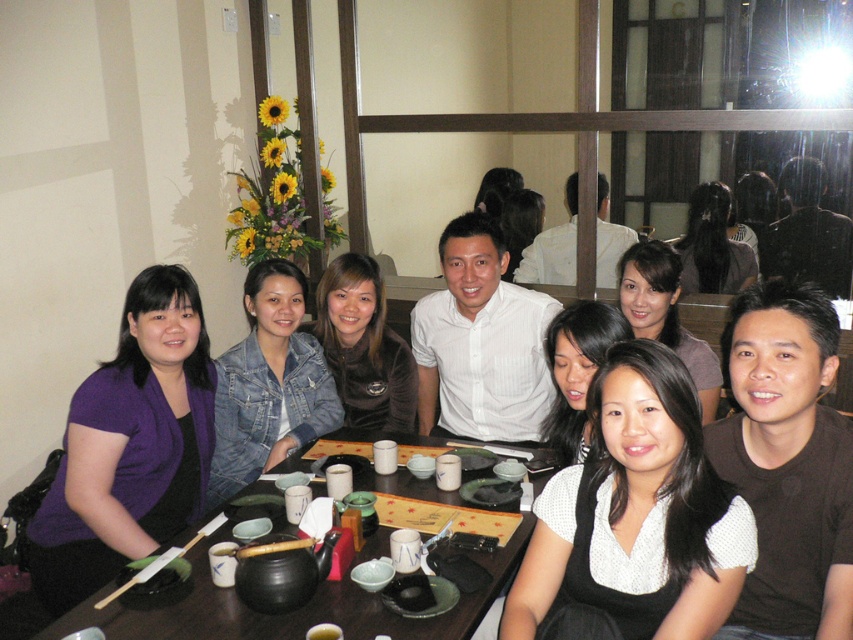
You are sitting at the table in the restaurant and want to grab the denim jacket at center and the smooth brown hair at center. Which one is closer to you?

The denim jacket at center is closer to you because it is further to the viewer than the smooth brown hair at center.